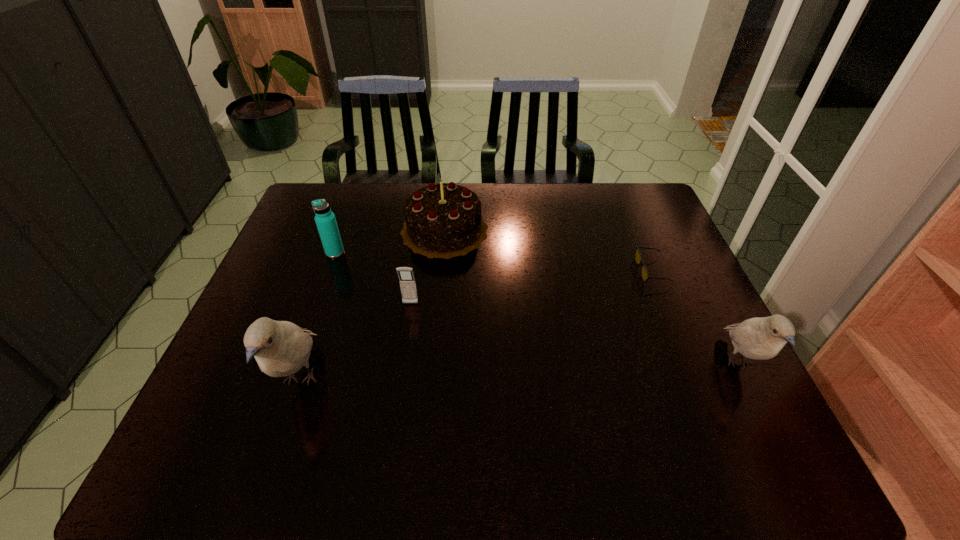
This screenshot has width=960, height=540. Find the location of `free space for an extra bird to achieve even spacing`. free space for an extra bird to achieve even spacing is located at coordinates (523, 372).